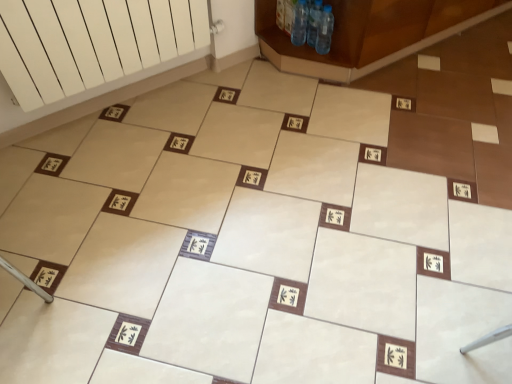
Question: Considering the relative sizes of clear plastic bottle at upper center, which appears as the second bottle when viewed from the right, and brown wooden cabinet at upper right in the image provided, is clear plastic bottle at upper center, which appears as the second bottle when viewed from the right, shorter than brown wooden cabinet at upper right?

Choices:
 (A) yes
 (B) no

Answer: (A)

Question: Are clear plastic bottle at upper center, which appears as the second bottle when viewed from the right, and brown wooden cabinet at upper right located far from each other?

Choices:
 (A) yes
 (B) no

Answer: (B)

Question: Considering the relative positions of clear plastic bottle at upper center, which appears as the second bottle when viewed from the left, and brown wooden cabinet at upper right in the image provided, is clear plastic bottle at upper center, which appears as the second bottle when viewed from the left, to the right of brown wooden cabinet at upper right from the viewer's perspective?

Choices:
 (A) yes
 (B) no

Answer: (B)

Question: Is brown wooden cabinet at upper right a part of clear plastic bottle at upper center, which appears as the second bottle when viewed from the left?

Choices:
 (A) no
 (B) yes

Answer: (A)

Question: From a real-world perspective, does clear plastic bottle at upper center, which appears as the second bottle when viewed from the right, stand above brown wooden cabinet at upper right?

Choices:
 (A) yes
 (B) no

Answer: (B)

Question: From their relative heights in the image, would you say brown wooden cabinet at upper right is taller or shorter than transparent plastic bottles at upper center, which is counted as the 3th bottle, starting from the left?

Choices:
 (A) tall
 (B) short

Answer: (A)

Question: In terms of width, does brown wooden cabinet at upper right look wider or thinner when compared to transparent plastic bottles at upper center, which is counted as the 3th bottle, starting from the left?

Choices:
 (A) thin
 (B) wide

Answer: (B)

Question: Is brown wooden cabinet at upper right situated inside transparent plastic bottles at upper center, positioned as the first bottle in right-to-left order, or outside?

Choices:
 (A) inside
 (B) outside

Answer: (B)

Question: Is brown wooden cabinet at upper right bigger or smaller than transparent plastic bottles at upper center, positioned as the first bottle in right-to-left order?

Choices:
 (A) big
 (B) small

Answer: (A)

Question: From the image's perspective, is transparent plastic bottles at upper center, which is counted as the 1th bottle, starting from the left, positioned above or below transparent plastic bottles at upper center, which is counted as the 3th bottle, starting from the left?

Choices:
 (A) above
 (B) below

Answer: (A)

Question: Is point (301, 41) positioned closer to the camera than point (330, 21)?

Choices:
 (A) closer
 (B) farther

Answer: (B)

Question: Considering the positions of transparent plastic bottles at upper center, which is the 3th bottle in right-to-left order, and transparent plastic bottles at upper center, which is counted as the 3th bottle, starting from the left, in the image, is transparent plastic bottles at upper center, which is the 3th bottle in right-to-left order, taller or shorter than transparent plastic bottles at upper center, which is counted as the 3th bottle, starting from the left,?

Choices:
 (A) tall
 (B) short

Answer: (A)

Question: From a real-world perspective, relative to transparent plastic bottles at upper center, positioned as the first bottle in right-to-left order, is transparent plastic bottles at upper center, which is counted as the 1th bottle, starting from the left, vertically above or below?

Choices:
 (A) above
 (B) below

Answer: (A)

Question: Is point (422, 39) positioned closer to the camera than point (308, 19)?

Choices:
 (A) farther
 (B) closer

Answer: (A)

Question: Is brown wooden cabinet at upper right to the left or to the right of clear plastic bottle at upper center, which appears as the second bottle when viewed from the right, in the image?

Choices:
 (A) left
 (B) right

Answer: (B)